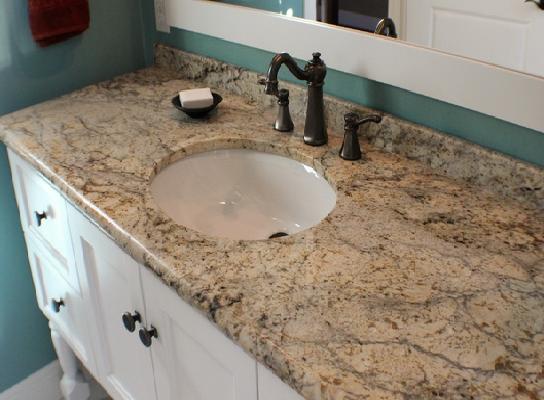
Find the location of a particular element. This screenshot has height=400, width=544. wall is located at coordinates pyautogui.click(x=90, y=50), pyautogui.click(x=432, y=116), pyautogui.click(x=30, y=334).